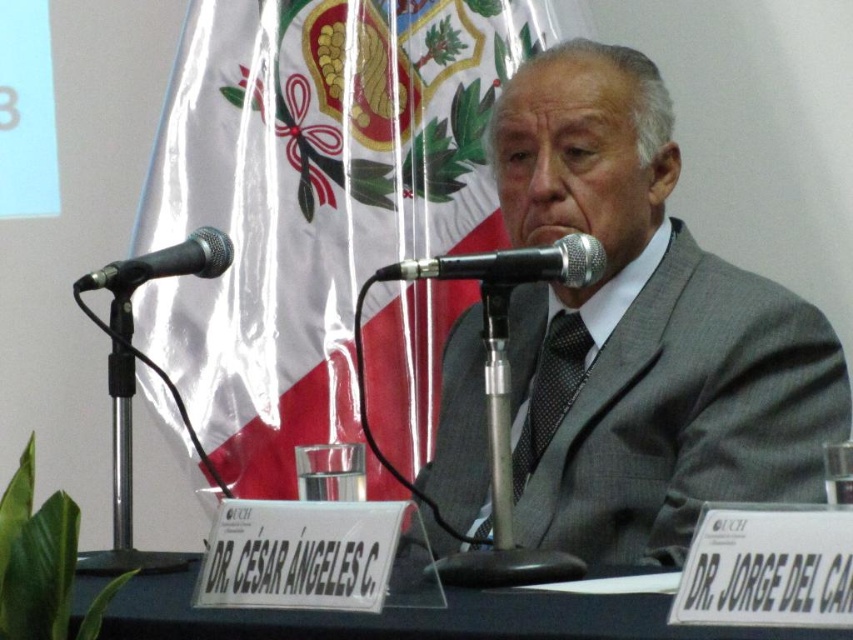
You are a photographer at the event and need to capture a closeup of the gray textured suit at center without the black metallic microphone at center appearing in the shot. Is this possible given their positions?

The black metallic microphone at center is behind the gray textured suit at center, so it would be obscured and not visible in the closeup of the gray textured suit at center.

You are an event organizer setting up a stage for a panel discussion. You have the gray textured suit at center and the black metallic microphone at center on the stage. Based on their positions, which object is closer to the front of the stage?

The black metallic microphone at center is closer to the front of the stage because the gray textured suit at center is positioned below it.

Based on the photo, you are a photographer at the event and want to capture a clear shot of the black textured tie at center without the black metallic microphone at left blocking it. What adjustment should you make to your camera position?

The black metallic microphone at left is behind the black textured tie at center, so to avoid the microphone blocking the tie, move the camera slightly to the right so that the microphone is out of frame while keeping the tie centered.